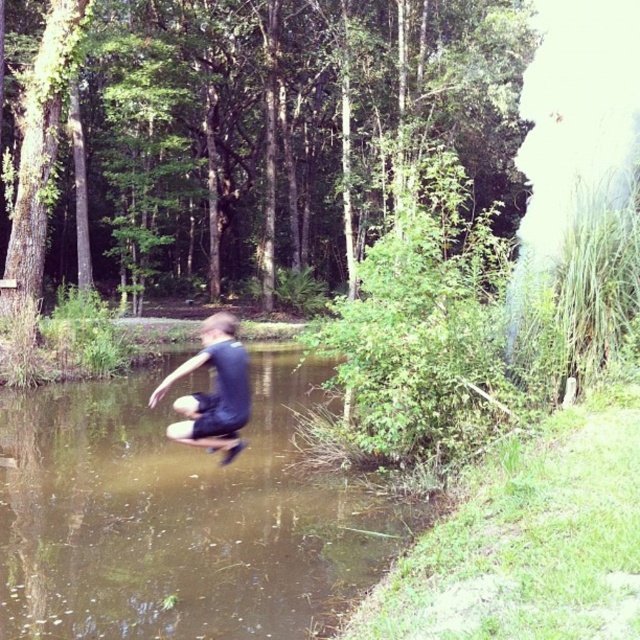
Question: Which object is closer to the camera taking this photo?

Choices:
 (A) brown murky water at center
 (B) dark blue fabric boy at center

Answer: (A)

Question: Among these points, which one is nearest to the camera?

Choices:
 (A) (227, 438)
 (B) (172, 513)

Answer: (A)

Question: Which point is farther to the camera?

Choices:
 (A) brown murky water at center
 (B) dark blue fabric boy at center

Answer: (B)

Question: Is brown murky water at center smaller than dark blue fabric boy at center?

Choices:
 (A) no
 (B) yes

Answer: (B)

Question: Can you confirm if brown murky water at center is thinner than dark blue fabric boy at center?

Choices:
 (A) yes
 (B) no

Answer: (B)

Question: Can you confirm if brown murky water at center is thinner than dark blue fabric boy at center?

Choices:
 (A) yes
 (B) no

Answer: (B)